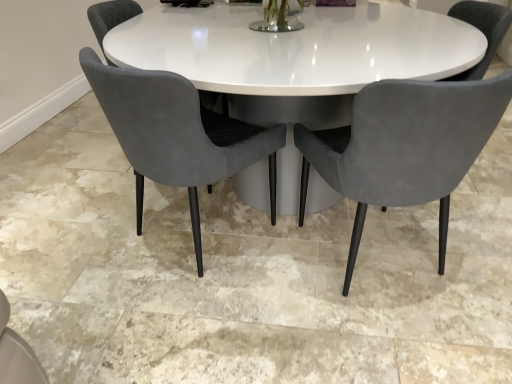
Where is `vacant space underneath velvet grey chair at center, the 3th chair positioned from the left (from a real-world perspective)`? The height and width of the screenshot is (384, 512). vacant space underneath velvet grey chair at center, the 3th chair positioned from the left (from a real-world perspective) is located at coordinates (378, 261).